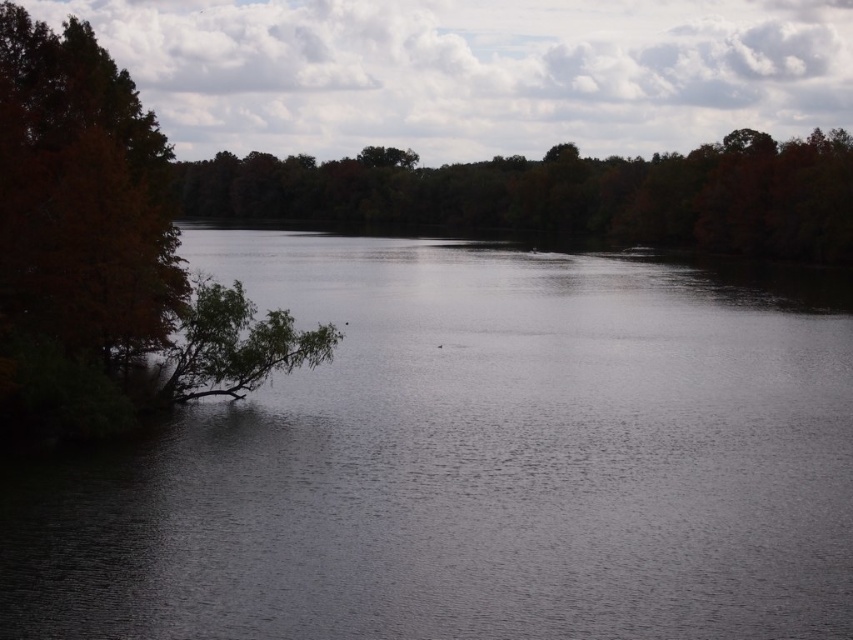
You are standing at the point marked by the coordinates point (471, 460) in the image. What is the color of the surface you are currently standing on?

The point (471, 460) marks dark water at center, so the surface you are standing on is dark water.

You are standing at the lakeside and want to walk towards the brown matte tree at center. Which direction should you move relative to the dark water at center?

You should move to the right of the dark water at center to reach the brown matte tree at center because the dark water at center is located to the left of the brown matte tree at center.